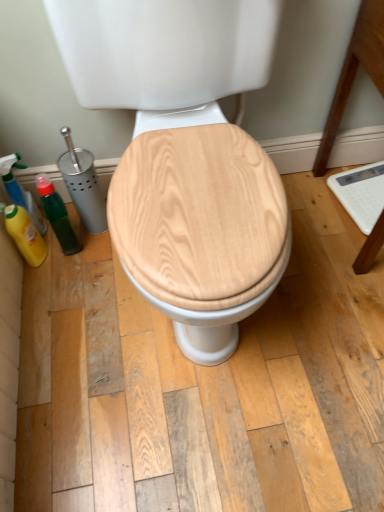
This screenshot has height=512, width=384. What are the coordinates of `empty space that is in between green matte bottle at left and matte green spray bottle at left, the first cleaning product when ordered from top to bottom` in the screenshot? It's located at (63, 236).